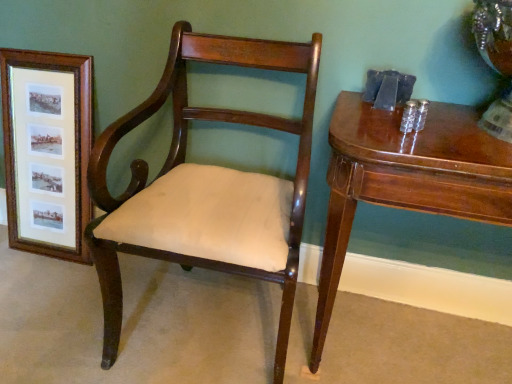
You are a GUI agent. You are given a task and a screenshot of the screen. Output one action in this format:
    pyautogui.click(x=<x>, y=<y>)
    Task: Click on the free point below glossy wood table at right (from a real-world perspective)
    The height and width of the screenshot is (384, 512).
    Given the screenshot: What is the action you would take?
    pyautogui.click(x=401, y=343)